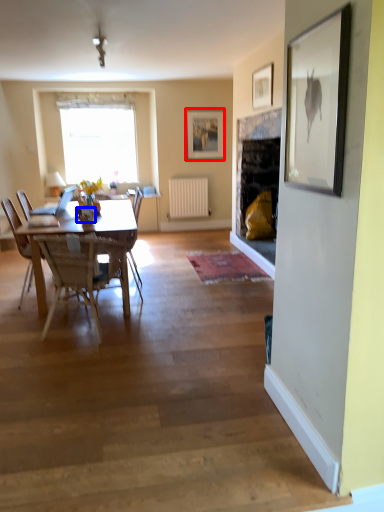
Question: Which object is closer to the camera taking this photo, picture frame (highlighted by a red box) or vase (highlighted by a blue box)?

Choices:
 (A) picture frame
 (B) vase

Answer: (B)